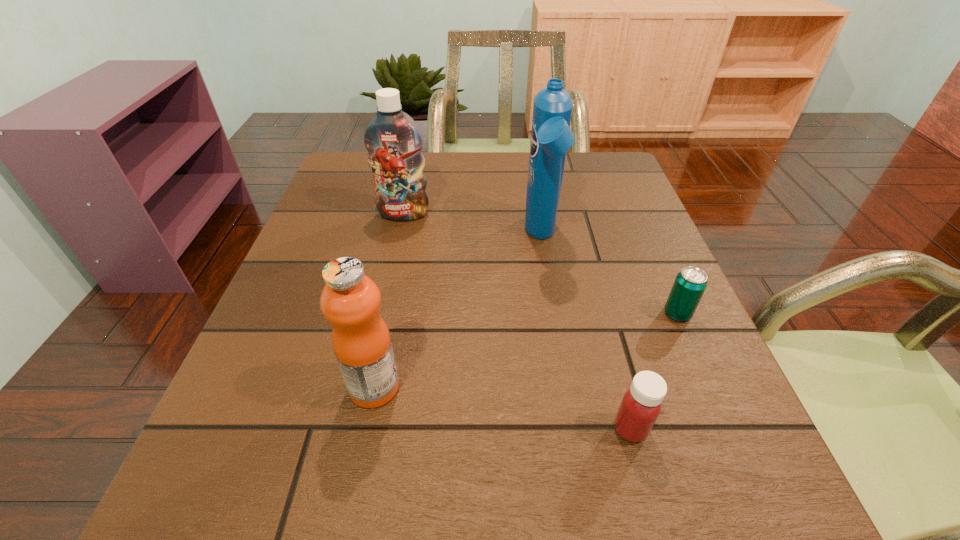
Locate an element on the screen. The width and height of the screenshot is (960, 540). free spot at the far right corner of the desktop is located at coordinates (x=578, y=180).

I want to click on vacant area that lies between the right shampoo and the medicine, so (586, 333).

I want to click on vacant area between the fruit juice and the third farthest object, so click(x=526, y=350).

Where is `vacant point located between the fruit juice and the left shampoo`? The width and height of the screenshot is (960, 540). vacant point located between the fruit juice and the left shampoo is located at coordinates (389, 300).

Identify the location of free space between the fruit juice and the right shampoo. Image resolution: width=960 pixels, height=540 pixels. (458, 312).

Identify the location of vacant area between the nearest object and the right shampoo. This screenshot has height=540, width=960. (586, 333).

The height and width of the screenshot is (540, 960). I want to click on free spot between the nearest object and the fruit juice, so click(502, 408).

I want to click on free space between the fourth farthest object and the medicine, so click(x=502, y=408).

Where is `vacant point located between the left shampoo and the shortest object`? This screenshot has height=540, width=960. vacant point located between the left shampoo and the shortest object is located at coordinates (540, 264).

You are a GUI agent. You are given a task and a screenshot of the screen. Output one action in this format:
    pyautogui.click(x=<x>, y=<y>)
    Task: Click on the unoccupied area between the fourth farthest object and the third object from left to right
    Image resolution: width=960 pixels, height=540 pixels.
    Given the screenshot: What is the action you would take?
    pyautogui.click(x=458, y=312)